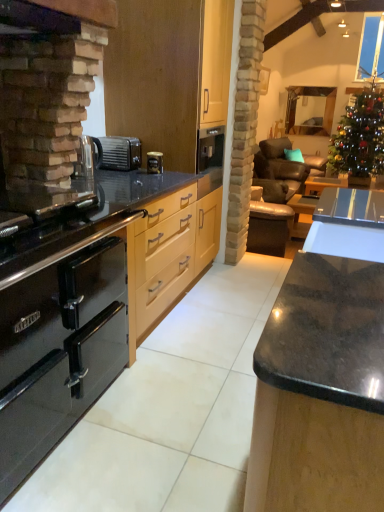
Question: Is green glittering christmas tree at upper right far away from transparent glass window at upper right?

Choices:
 (A) no
 (B) yes

Answer: (A)

Question: From a real-world perspective, is green glittering christmas tree at upper right positioned over transparent glass window at upper right based on gravity?

Choices:
 (A) no
 (B) yes

Answer: (A)

Question: Can you confirm if green glittering christmas tree at upper right is positioned to the right of transparent glass window at upper right?

Choices:
 (A) no
 (B) yes

Answer: (A)

Question: Is green glittering christmas tree at upper right at the left side of transparent glass window at upper right?

Choices:
 (A) no
 (B) yes

Answer: (B)

Question: Considering the relative sizes of green glittering christmas tree at upper right and transparent glass window at upper right in the image provided, is green glittering christmas tree at upper right taller than transparent glass window at upper right?

Choices:
 (A) no
 (B) yes

Answer: (B)

Question: Is black matte toaster at center wider or thinner than leather at right?

Choices:
 (A) thin
 (B) wide

Answer: (A)

Question: From the image's perspective, is black matte toaster at center above or below leather at right?

Choices:
 (A) below
 (B) above

Answer: (A)

Question: Considering the positions of point (114, 163) and point (291, 151), is point (114, 163) closer or farther from the camera than point (291, 151)?

Choices:
 (A) farther
 (B) closer

Answer: (B)

Question: Is black matte toaster at center bigger or smaller than leather at right?

Choices:
 (A) big
 (B) small

Answer: (B)

Question: In terms of size, does black glass countertop at left appear bigger or smaller than leather at right?

Choices:
 (A) big
 (B) small

Answer: (B)

Question: Visually, is black glass countertop at left positioned to the left or to the right of leather at right?

Choices:
 (A) left
 (B) right

Answer: (A)

Question: Is point (29, 239) positioned closer to the camera than point (286, 172)?

Choices:
 (A) farther
 (B) closer

Answer: (B)

Question: Would you say black glass countertop at left is inside or outside leather at right?

Choices:
 (A) inside
 (B) outside

Answer: (B)

Question: Is black matte toaster at center taller or shorter than transparent glass window at upper right?

Choices:
 (A) short
 (B) tall

Answer: (A)

Question: In terms of width, does black matte toaster at center look wider or thinner when compared to transparent glass window at upper right?

Choices:
 (A) wide
 (B) thin

Answer: (A)